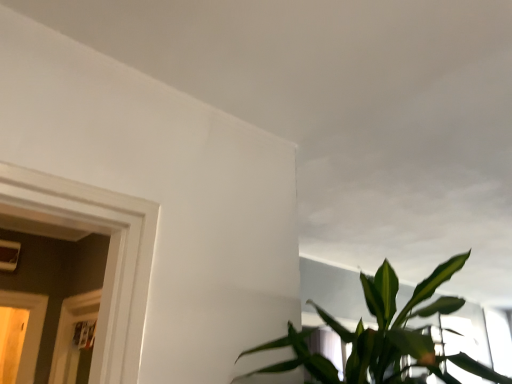
What is the approximate width of green leafy plant at lower right?

green leafy plant at lower right is 30.66 inches wide.

The image size is (512, 384). In order to click on green leafy plant at lower right in this screenshot , I will do `click(382, 336)`.

Image resolution: width=512 pixels, height=384 pixels. Describe the element at coordinates (382, 336) in the screenshot. I see `green leafy plant at lower right` at that location.

Identify the location of green leafy plant at lower right. (382, 336).